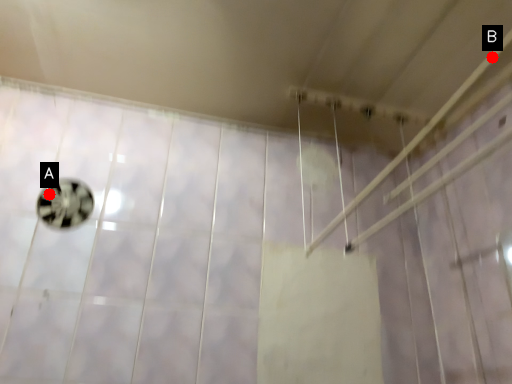
Question: Two points are circled on the image, labeled by A and B beside each circle. Among these points, which one is farthest from the camera?

Choices:
 (A) A is further
 (B) B is further

Answer: (A)